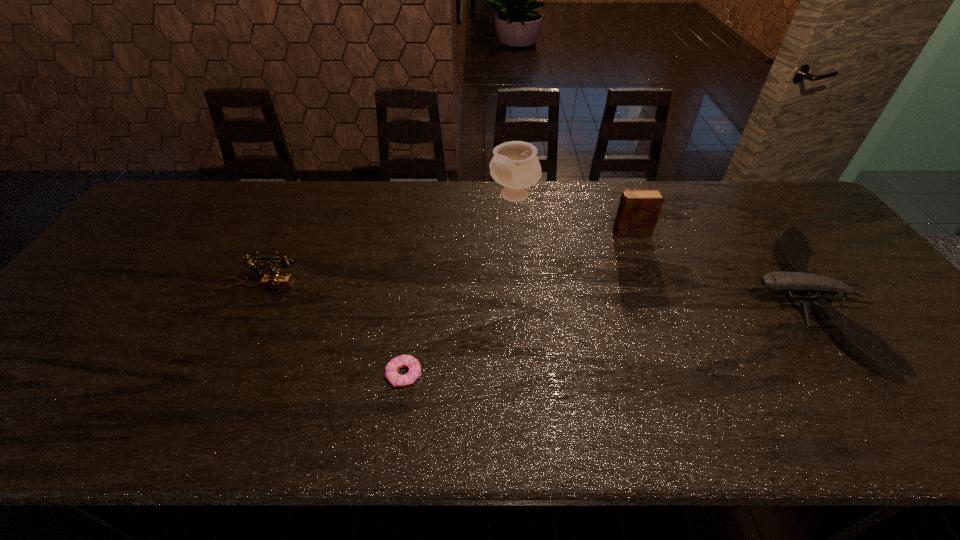
Identify the location of pottery. This screenshot has width=960, height=540. (514, 165).

Find the location of a particular element. This screenshot has width=960, height=540. the tallest object is located at coordinates (514, 165).

At what (x,y) coordinates should I click in order to perform the action: click on diary. Please return your answer as a coordinate pair (x, y). The height and width of the screenshot is (540, 960). Looking at the image, I should click on (639, 208).

Image resolution: width=960 pixels, height=540 pixels. I want to click on the fourth object from left to right, so click(639, 208).

This screenshot has width=960, height=540. I want to click on the leftmost object, so click(275, 279).

The image size is (960, 540). What are the coordinates of `the rightmost object` in the screenshot? It's located at (795, 244).

The height and width of the screenshot is (540, 960). Identify the location of the second object from left to right. (397, 380).

Where is `the shortest object`? the shortest object is located at coordinates (397, 380).

Find the location of a particular element. This screenshot has height=540, width=960. free location located 0.150m on the right of the third object from left to right is located at coordinates click(x=585, y=197).

Find the location of a particular element. The height and width of the screenshot is (540, 960). vacant space located 0.200m on the spine side of the diary is located at coordinates (546, 232).